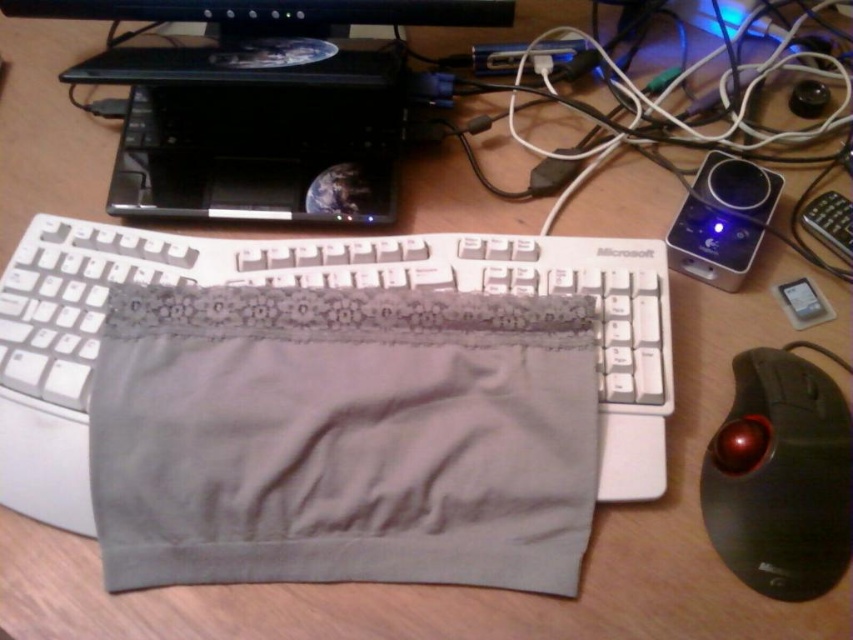
Consider the image. Is gray fabric pocket at center shorter than black rubberized trackball at lower right?

No.

Image resolution: width=853 pixels, height=640 pixels. Describe the element at coordinates (341, 436) in the screenshot. I see `gray fabric pocket at center` at that location.

Is point (360, 317) positioned behind point (732, 451)?

That is True.

The width and height of the screenshot is (853, 640). I want to click on gray fabric pocket at center, so click(x=341, y=436).

Is black rubberized trackball at lower right wider than black plastic monitor at upper center?

Incorrect, black rubberized trackball at lower right's width does not surpass black plastic monitor at upper center's.

Is black rubberized trackball at lower right to the right of black plastic monitor at upper center from the viewer's perspective?

Yes, black rubberized trackball at lower right is to the right of black plastic monitor at upper center.

From the picture: Measure the distance between black rubberized trackball at lower right and camera.

A distance of 19.55 inches exists between black rubberized trackball at lower right and camera.

Identify the location of black rubberized trackball at lower right. This screenshot has width=853, height=640. (780, 477).

Which is in front, point (186, 51) or point (764, 573)?

Point (764, 573)

Between satin black laptop at upper center and black rubberized trackball at lower right, which one has more height?

satin black laptop at upper center is taller.

The height and width of the screenshot is (640, 853). I want to click on satin black laptop at upper center, so click(x=253, y=134).